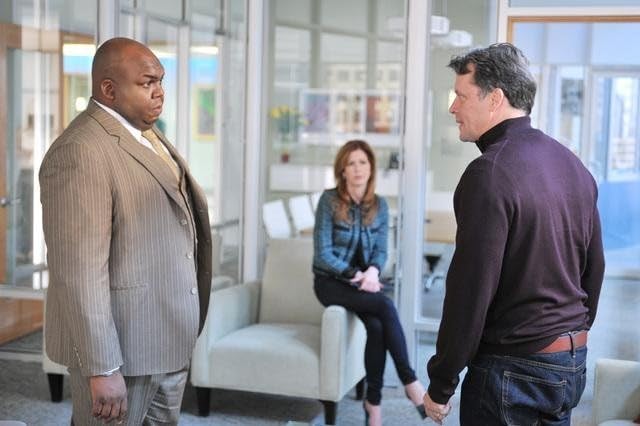
Where is `gray chairs`? gray chairs is located at coordinates (256, 351), (605, 387).